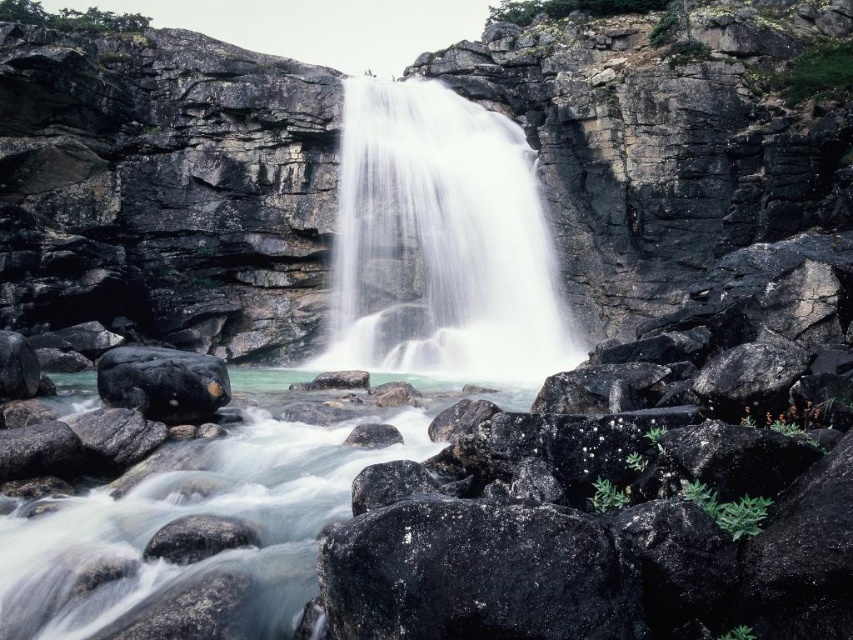
You are standing at the point marked as point (483,184) and want to take a photo of the waterfall. If your camera is 107.60 feet away from you, will you be able to capture the entire waterfall in the photo?

Yes, since the camera is 107.60 feet away from point (483,184), you can capture the entire waterfall in the photo as the distance allows the camera to encompass the whole scene.

From the picture: You are standing at the edge of the waterfall and want to take a photo. There are two points of interest marked as point 1 at coordinates point [215,456] and point 2 at coordinates point [190,419]. Which point is closer to your current position?

Point [215,456] is closer to the camera than point [190,419], so point 1 is closer to your current position.